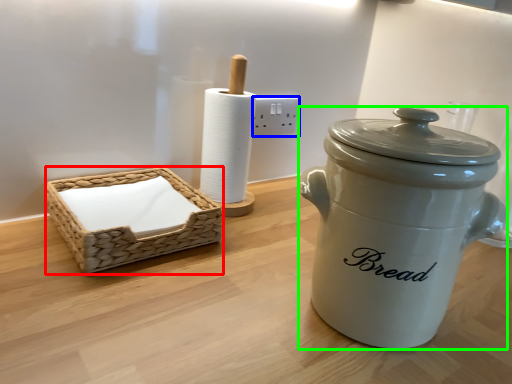
Question: Which object is positioned farthest from basket (highlighted by a red box)? Select from electric outlet (highlighted by a blue box) and crock pot (highlighted by a green box).

Choices:
 (A) electric outlet
 (B) crock pot

Answer: (A)